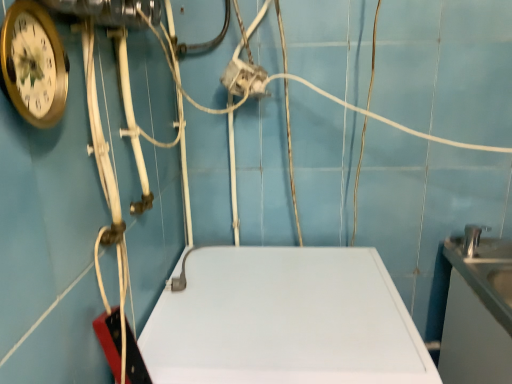
Where is `vacant space situated above white matte counter top at center, positioned as the first counter top in left-to-right order (from a real-world perspective)`? The width and height of the screenshot is (512, 384). vacant space situated above white matte counter top at center, positioned as the first counter top in left-to-right order (from a real-world perspective) is located at coordinates (279, 309).